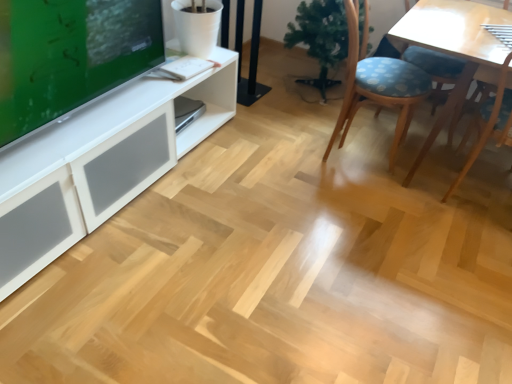
Where is `vacant area situated below blue fabric chair at center-right (from a real-world perspective)`? The height and width of the screenshot is (384, 512). vacant area situated below blue fabric chair at center-right (from a real-world perspective) is located at coordinates pyautogui.click(x=350, y=147).